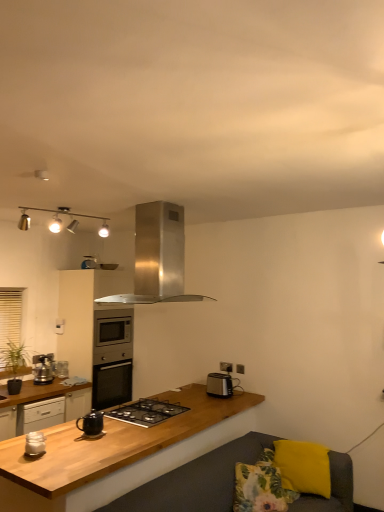
This screenshot has height=512, width=384. What do you see at coordinates (60, 220) in the screenshot?
I see `metallic track lights at upper center` at bounding box center [60, 220].

Based on the photo, what is the approximate height of matte black kettle at center?

The height of matte black kettle at center is 6.22 inches.

Find the location of a particular element. matte black kettle at center is located at coordinates (91, 424).

Describe the element at coordinates (219, 385) in the screenshot. The height and width of the screenshot is (512, 384). I see `black plastic toaster at right, which appears as the third kitchen appliance when viewed from the front` at that location.

What do you see at coordinates (119, 453) in the screenshot?
I see `wooden at center` at bounding box center [119, 453].

Identify the location of yellow fabric pillow at lower right, the first pillow positioned from the right. The image size is (384, 512). 303,467.

This screenshot has height=512, width=384. I want to click on metallic silver toaster at left, which is the fourth kitchen appliance from top to bottom, so click(x=43, y=370).

Find the location of a particular element. This screenshot has width=384, height=512. black glass gas stove at center is located at coordinates (146, 412).

Image resolution: width=384 pixels, height=512 pixels. What are the coordinates of `metallic track lights at upper center` in the screenshot? It's located at (60, 220).

From a real-world perspective, is yellow fabric pillow at lower right, positioned as the 2th pillow in left-to-right order, physically located above or below stainless steel range hood at upper center, placed as the 3th kitchen appliance when sorted from left to right?

yellow fabric pillow at lower right, positioned as the 2th pillow in left-to-right order, is situated lower than stainless steel range hood at upper center, placed as the 3th kitchen appliance when sorted from left to right, in the real world.

Is yellow fabric pillow at lower right, positioned as the 2th pillow in left-to-right order, smaller than stainless steel range hood at upper center, placed as the fourth kitchen appliance when sorted from bottom to top?

Indeed, yellow fabric pillow at lower right, positioned as the 2th pillow in left-to-right order, has a smaller size compared to stainless steel range hood at upper center, placed as the fourth kitchen appliance when sorted from bottom to top.

Does yellow fabric pillow at lower right, the first pillow positioned from the right, contain stainless steel range hood at upper center, positioned as the 3th kitchen appliance in back-to-front order?

No, stainless steel range hood at upper center, positioned as the 3th kitchen appliance in back-to-front order, is not a part of yellow fabric pillow at lower right, the first pillow positioned from the right.

Between satin silver oven at center, the first cabinetry in the back-to-front sequence, and white plastic electric outlet at upper right, which one is positioned in front?

white plastic electric outlet at upper right.

Starting from the white plastic electric outlet at upper right, which cabinetry is the 1st one to the left? Please provide its 2D coordinates.

[(94, 339)]

Is satin silver oven at center, which is counted as the second cabinetry, starting from the front, positioned far away from white plastic electric outlet at upper right?

Yes, satin silver oven at center, which is counted as the second cabinetry, starting from the front, and white plastic electric outlet at upper right are located far from each other.

Based on the photo, is satin silver oven at center, which is counted as the second cabinetry, starting from the front, turned away from white plastic electric outlet at upper right?

No, satin silver oven at center, which is counted as the second cabinetry, starting from the front, is not facing away from white plastic electric outlet at upper right.

How much distance is there between satin silver oven at center, which is counted as the second cabinetry, starting from the front, and black plastic toaster at right, arranged as the 4th kitchen appliance when viewed from the left?

satin silver oven at center, which is counted as the second cabinetry, starting from the front, and black plastic toaster at right, arranged as the 4th kitchen appliance when viewed from the left, are 5.17 feet apart.

Considering the relative sizes of satin silver oven at center, which is counted as the second cabinetry, starting from the front, and black plastic toaster at right, which ranks as the third kitchen appliance in top-to-bottom order, in the image provided, is satin silver oven at center, which is counted as the second cabinetry, starting from the front, smaller than black plastic toaster at right, which ranks as the third kitchen appliance in top-to-bottom order,?

No, satin silver oven at center, which is counted as the second cabinetry, starting from the front, is not smaller than black plastic toaster at right, which ranks as the third kitchen appliance in top-to-bottom order.

Does satin silver oven at center, the first cabinetry in the back-to-front sequence, have a lesser width compared to black plastic toaster at right, which ranks as the 2th kitchen appliance in back-to-front order?

No, satin silver oven at center, the first cabinetry in the back-to-front sequence, is not thinner than black plastic toaster at right, which ranks as the 2th kitchen appliance in back-to-front order.

Can you confirm if satin silver oven at center, the first cabinetry in the back-to-front sequence, is shorter than black plastic toaster at right, the 1th kitchen appliance positioned from the right?

No.

Is yellow fabric pillow at lower right, positioned as the 2th pillow in left-to-right order, far from satin silver oven at center, the first cabinetry in the back-to-front sequence?

Yes, yellow fabric pillow at lower right, positioned as the 2th pillow in left-to-right order, is far from satin silver oven at center, the first cabinetry in the back-to-front sequence.

Could satin silver oven at center, the first cabinetry in the back-to-front sequence, be considered to be inside yellow fabric pillow at lower right, the first pillow positioned from the right?

No, satin silver oven at center, the first cabinetry in the back-to-front sequence, is not a part of yellow fabric pillow at lower right, the first pillow positioned from the right.

Considering the relative sizes of yellow fabric pillow at lower right, positioned as the 2th pillow in left-to-right order, and satin silver oven at center, which is counted as the second cabinetry, starting from the front, in the image provided, is yellow fabric pillow at lower right, positioned as the 2th pillow in left-to-right order, wider than satin silver oven at center, which is counted as the second cabinetry, starting from the front,?

No.

Based on the photo, from the image's perspective, is black plastic toaster at right, arranged as the 4th kitchen appliance when viewed from the left, on top of wooden cabinet at lower left, positioned as the first cabinetry in front-to-back order?

Indeed, from the image's perspective, black plastic toaster at right, arranged as the 4th kitchen appliance when viewed from the left, is shown above wooden cabinet at lower left, positioned as the first cabinetry in front-to-back order.

Is black plastic toaster at right, which ranks as the third kitchen appliance in top-to-bottom order, in front of wooden cabinet at lower left, placed as the second cabinetry when sorted from back to front?

Result: No, black plastic toaster at right, which ranks as the third kitchen appliance in top-to-bottom order, is further to the viewer.

Considering the sizes of objects black plastic toaster at right, which ranks as the 2th kitchen appliance in back-to-front order, and wooden cabinet at lower left, placed as the second cabinetry when sorted from back to front, in the image provided, who is thinner, black plastic toaster at right, which ranks as the 2th kitchen appliance in back-to-front order, or wooden cabinet at lower left, placed as the second cabinetry when sorted from back to front,?

With smaller width is black plastic toaster at right, which ranks as the 2th kitchen appliance in back-to-front order.

How many degrees apart are the facing directions of metallic track lights at upper center and white glossy jar at lower left, the third kitchen appliance positioned from the bottom?

177 degrees.

Between metallic track lights at upper center and white glossy jar at lower left, which is counted as the 4th kitchen appliance, starting from the back, which one has smaller size?

Smaller between the two is white glossy jar at lower left, which is counted as the 4th kitchen appliance, starting from the back.

Between metallic track lights at upper center and white glossy jar at lower left, the third kitchen appliance positioned from the bottom, which one appears on the left side from the viewer's perspective?

Positioned to the left is metallic track lights at upper center.

Is black plastic toaster at right, which ranks as the third kitchen appliance in top-to-bottom order, in contact with yellow fabric pillow at lower right, positioned as the 2th pillow in left-to-right order?

black plastic toaster at right, which ranks as the third kitchen appliance in top-to-bottom order, and yellow fabric pillow at lower right, positioned as the 2th pillow in left-to-right order, are not in contact.

Measure the distance from black plastic toaster at right, which ranks as the 2th kitchen appliance in back-to-front order, to yellow fabric pillow at lower right, the first pillow positioned from the right.

black plastic toaster at right, which ranks as the 2th kitchen appliance in back-to-front order, is 84.01 centimeters from yellow fabric pillow at lower right, the first pillow positioned from the right.

Considering the relative sizes of black plastic toaster at right, the 1th kitchen appliance positioned from the right, and yellow fabric pillow at lower right, positioned as the 2th pillow in left-to-right order, in the image provided, is black plastic toaster at right, the 1th kitchen appliance positioned from the right, bigger than yellow fabric pillow at lower right, positioned as the 2th pillow in left-to-right order,?

No, black plastic toaster at right, the 1th kitchen appliance positioned from the right, is not bigger than yellow fabric pillow at lower right, positioned as the 2th pillow in left-to-right order.

Which object is further away from the camera taking this photo, black plastic toaster at right, the 1th kitchen appliance positioned from the right, or yellow fabric pillow at lower right, the first pillow positioned from the right?

Positioned behind is black plastic toaster at right, the 1th kitchen appliance positioned from the right.

I want to click on the 4th kitchen appliance above the yellow fabric pillow at lower right, the first pillow positioned from the right (from the image's perspective), so click(x=158, y=257).

Image resolution: width=384 pixels, height=512 pixels. What are the coordinates of `electric outlet below the satin silver oven at center, the first cabinetry in the back-to-front sequence (from a real-world perspective)` in the screenshot? It's located at (226, 367).

Based on their spatial positions, is stainless steel range hood at upper center, which ranks as the 1th kitchen appliance in top-to-bottom order, or metallic silver toaster at left, which is the fourth kitchen appliance in right-to-left order, further from matte black kettle at center?

The object further to matte black kettle at center is metallic silver toaster at left, which is the fourth kitchen appliance in right-to-left order.

When comparing their distances from wooden at center, does matte black kettle at center or satin silver oven at center, the first cabinetry in the back-to-front sequence, seem closer?

The object closer to wooden at center is matte black kettle at center.

Considering their positions, is black plastic toaster at right, which ranks as the 2th kitchen appliance in back-to-front order, positioned further to metallic track lights at upper center than white glossy jar at lower left, the second kitchen appliance positioned from the left?

Among the two, white glossy jar at lower left, the second kitchen appliance positioned from the left, is located further to metallic track lights at upper center.

When comparing their distances from wooden at center, does matte black kettle at center or stainless steel range hood at upper center, which ranks as the 1th kitchen appliance in top-to-bottom order, seem further?

stainless steel range hood at upper center, which ranks as the 1th kitchen appliance in top-to-bottom order, lies further to wooden at center than the other object.

When comparing their distances from wooden cabinet at lower left, positioned as the first cabinetry in front-to-back order, does white plastic electric outlet at upper right or satin silver oven at center, the first cabinetry in the back-to-front sequence, seem closer?

satin silver oven at center, the first cabinetry in the back-to-front sequence, lies closer to wooden cabinet at lower left, positioned as the first cabinetry in front-to-back order, than the other object.

When comparing their distances from stainless steel range hood at upper center, which ranks as the 1th kitchen appliance in top-to-bottom order, does black plastic toaster at right, which appears as the third kitchen appliance when viewed from the front, or black glass gas stove at center seem further?

Among the two, black plastic toaster at right, which appears as the third kitchen appliance when viewed from the front, is located further to stainless steel range hood at upper center, which ranks as the 1th kitchen appliance in top-to-bottom order.

From the picture: When comparing their distances from metallic silver toaster at left, which is the fourth kitchen appliance in right-to-left order, does yellow fabric pillow at lower right, the first pillow positioned from the right, or metallic track lights at upper center seem further?

Among the two, yellow fabric pillow at lower right, the first pillow positioned from the right, is located further to metallic silver toaster at left, which is the fourth kitchen appliance in right-to-left order.

Based on their spatial positions, is wooden at center or black plastic toaster at right, marked as the second kitchen appliance in a bottom-to-top arrangement, further from satin silver oven at center, which is counted as the second cabinetry, starting from the front?

black plastic toaster at right, marked as the second kitchen appliance in a bottom-to-top arrangement.

The height and width of the screenshot is (512, 384). What are the coordinates of `appliance between stainless steel range hood at upper center, positioned as the 3th kitchen appliance in back-to-front order, and floral fabric pillow at lower right, marked as the first pillow in a left-to-right arrangement, in the vertical direction` in the screenshot? It's located at (91, 424).

I want to click on pillow between metallic silver toaster at left, which is the fourth kitchen appliance in right-to-left order, and yellow fabric pillow at lower right, the first pillow positioned from the right, from left to right, so click(261, 486).

This screenshot has width=384, height=512. I want to click on countertop between matte black kettle at center and floral fabric pillow at lower right, which appears as the 2th pillow when viewed from the right, from left to right, so click(119, 453).

In order to click on cabinetry between black glass gas stove at center and satin silver oven at center, the first cabinetry in the back-to-front sequence, along the z-axis in this screenshot , I will do `click(42, 407)`.